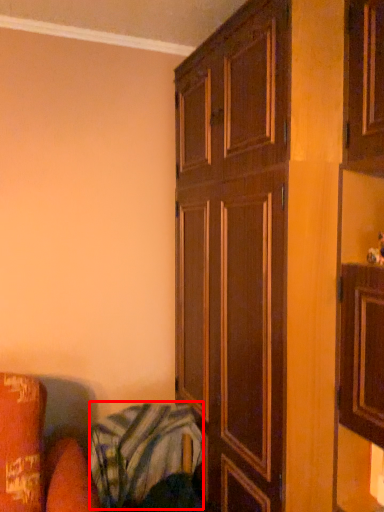
Question: From the image's perspective, where is blanket (annotated by the red box) located in relation to cupboard in the image?

Choices:
 (A) above
 (B) below

Answer: (B)